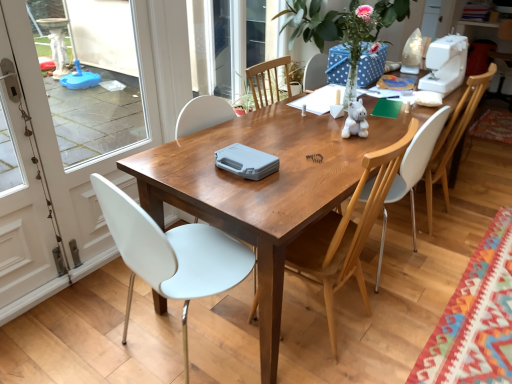
Locate an element on the screen. free space to the left of white plastic chair at left, acting as the 1th chair starting from the left is located at coordinates (88, 330).